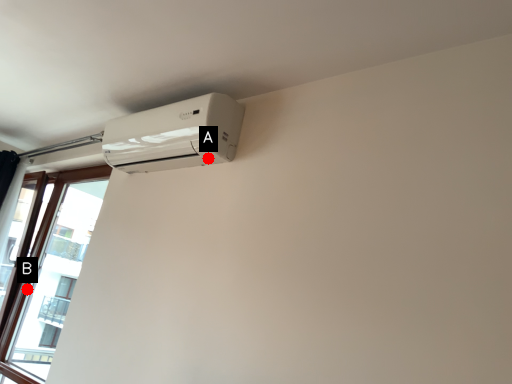
Question: Two points are circled on the image, labeled by A and B beside each circle. Which point is closer to the camera taking this photo?

Choices:
 (A) A is closer
 (B) B is closer

Answer: (A)